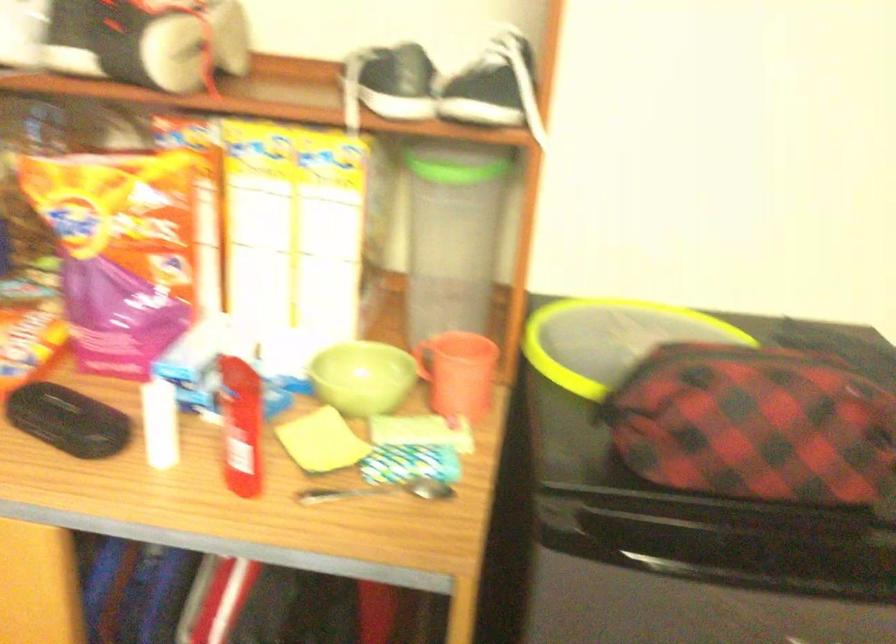
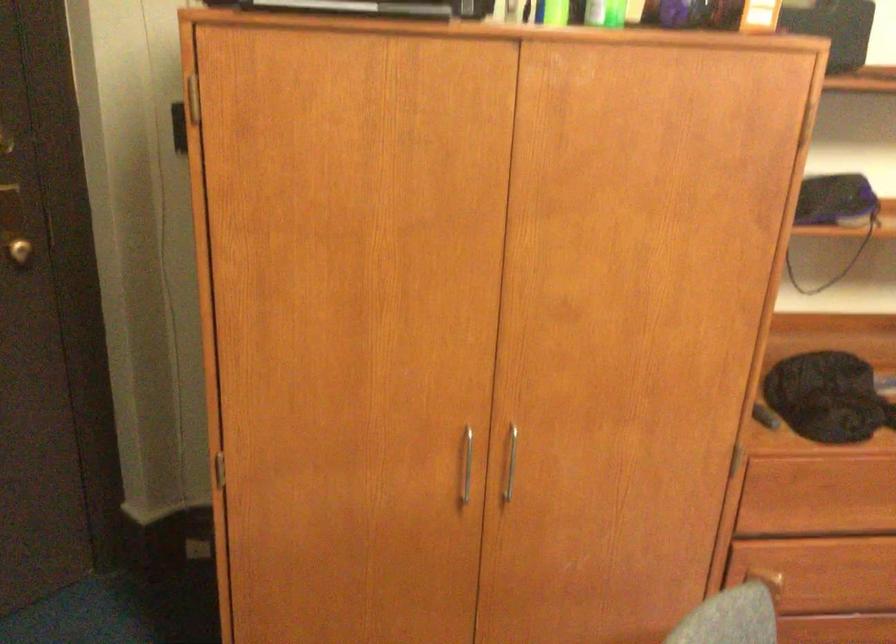
How did the camera likely rotate?

The camera rotated toward right-down.